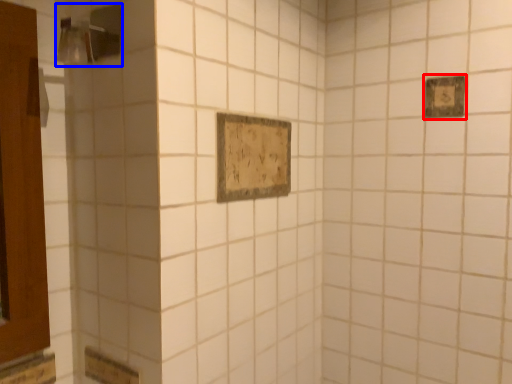
Question: Which object appears farthest to the camera in this image, rectangle (highlighted by a red box) or shower (highlighted by a blue box)?

Choices:
 (A) rectangle
 (B) shower

Answer: (A)